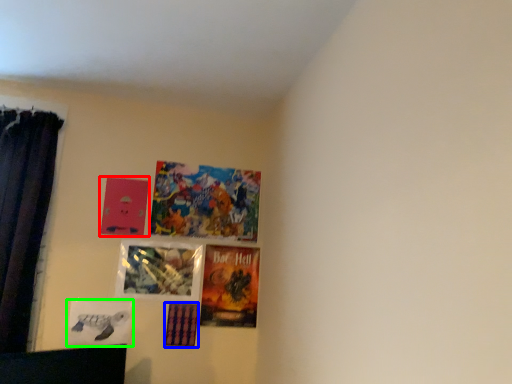
Question: Which object is positioned closest to picture frame (highlighted by a red box)? Select from picture frame (highlighted by a blue box) and picture frame (highlighted by a green box).

Choices:
 (A) picture frame
 (B) picture frame

Answer: (B)